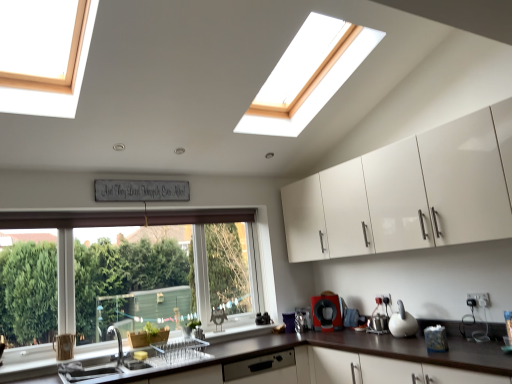
Question: Does matte stainless steel sink at lower left appear on the left side of white glossy kettle at right, which is the 1th appliance in front-to-back order?

Choices:
 (A) no
 (B) yes

Answer: (B)

Question: Is the position of matte stainless steel sink at lower left more distant than that of white glossy kettle at right, which is the 1th appliance in front-to-back order?

Choices:
 (A) yes
 (B) no

Answer: (B)

Question: Does matte stainless steel sink at lower left come in front of white glossy kettle at right, which is the first appliance from right to left?

Choices:
 (A) yes
 (B) no

Answer: (A)

Question: Is white glossy kettle at right, which is the 1th appliance in front-to-back order, inside matte stainless steel sink at lower left?

Choices:
 (A) yes
 (B) no

Answer: (B)

Question: Are matte stainless steel sink at lower left and white glossy kettle at right, which is the 1th appliance in front-to-back order, beside each other?

Choices:
 (A) no
 (B) yes

Answer: (A)

Question: Can you confirm if matte stainless steel sink at lower left is smaller than white glossy kettle at right, which is the first appliance from right to left?

Choices:
 (A) yes
 (B) no

Answer: (B)

Question: Can you confirm if brown matte countertop at lower left is taller than black matte coffee maker at lower center, placed as the second appliance when sorted from front to back?

Choices:
 (A) yes
 (B) no

Answer: (A)

Question: From a real-world perspective, is brown matte countertop at lower left located beneath black matte coffee maker at lower center, placed as the second appliance when sorted from back to front?

Choices:
 (A) no
 (B) yes

Answer: (B)

Question: Is brown matte countertop at lower left completely or partially outside of black matte coffee maker at lower center, marked as the 2th appliance in a right-to-left arrangement?

Choices:
 (A) no
 (B) yes

Answer: (B)

Question: From a real-world perspective, does brown matte countertop at lower left stand above black matte coffee maker at lower center, placed as the second appliance when sorted from back to front?

Choices:
 (A) yes
 (B) no

Answer: (B)

Question: Is brown matte countertop at lower left in contact with black matte coffee maker at lower center, placed as the second appliance when sorted from front to back?

Choices:
 (A) no
 (B) yes

Answer: (A)

Question: Considering the relative sizes of brown matte countertop at lower left and black matte coffee maker at lower center, placed as the second appliance when sorted from front to back, in the image provided, is brown matte countertop at lower left thinner than black matte coffee maker at lower center, placed as the second appliance when sorted from front to back,?

Choices:
 (A) yes
 (B) no

Answer: (B)

Question: Does black matte coffee maker at lower center, placed as the second appliance when sorted from front to back, have a lesser width compared to clear glass window at lower left?

Choices:
 (A) no
 (B) yes

Answer: (A)